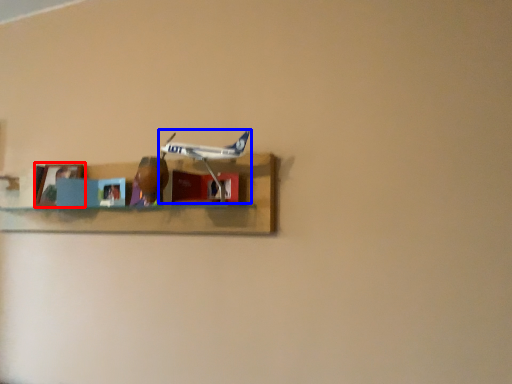
Question: Which point is closer to the camera, picture frame (highlighted by a red box) or airplane (highlighted by a blue box)?

Choices:
 (A) picture frame
 (B) airplane

Answer: (B)